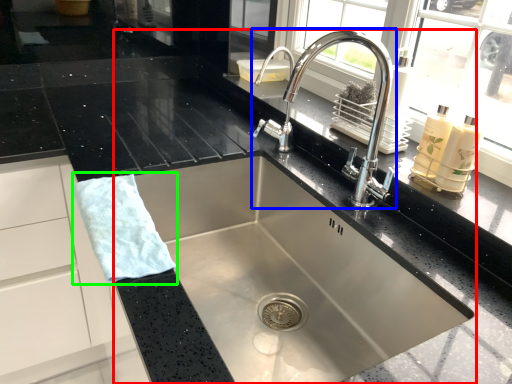
Question: Estimate the real-world distances between objects in this image. Which object is closer to sink (highlighted by a red box), tap (highlighted by a blue box) or hand towel (highlighted by a green box)?

Choices:
 (A) tap
 (B) hand towel

Answer: (A)